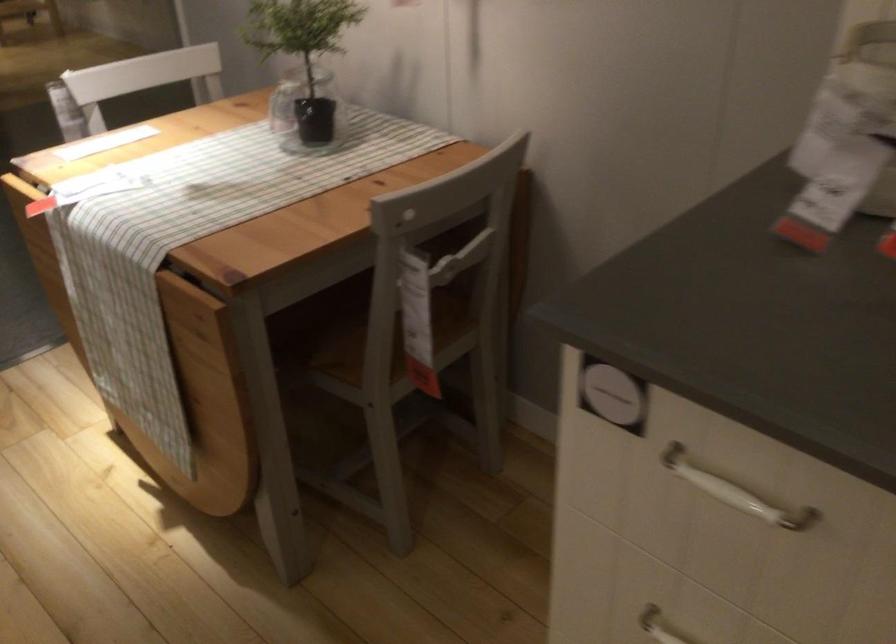
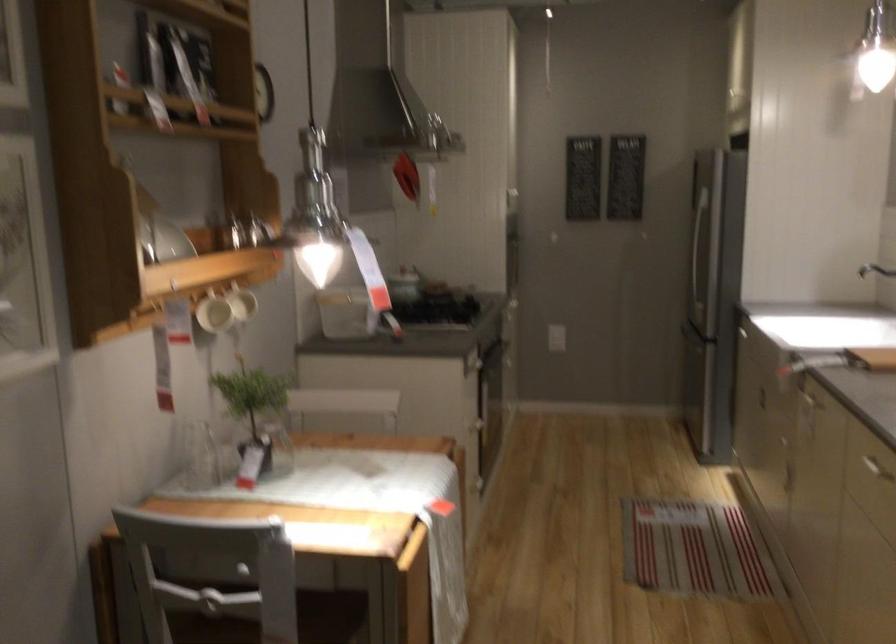
Question: I am providing you with two images of the same scene from different viewpoints. Which of the following objects are not visible in image2?

Choices:
 (A) oven door handle
 (B) white spray can nozzle
 (C) refrigerator door handle
 (D) chair sitting surface

Answer: (D)